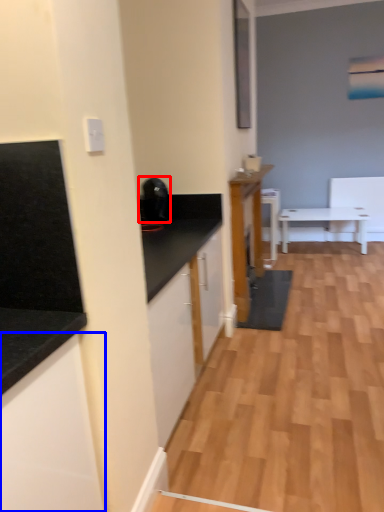
Question: Which of the following is the farthest to the observer, appliance (highlighted by a red box) or cabinetry (highlighted by a blue box)?

Choices:
 (A) appliance
 (B) cabinetry

Answer: (A)